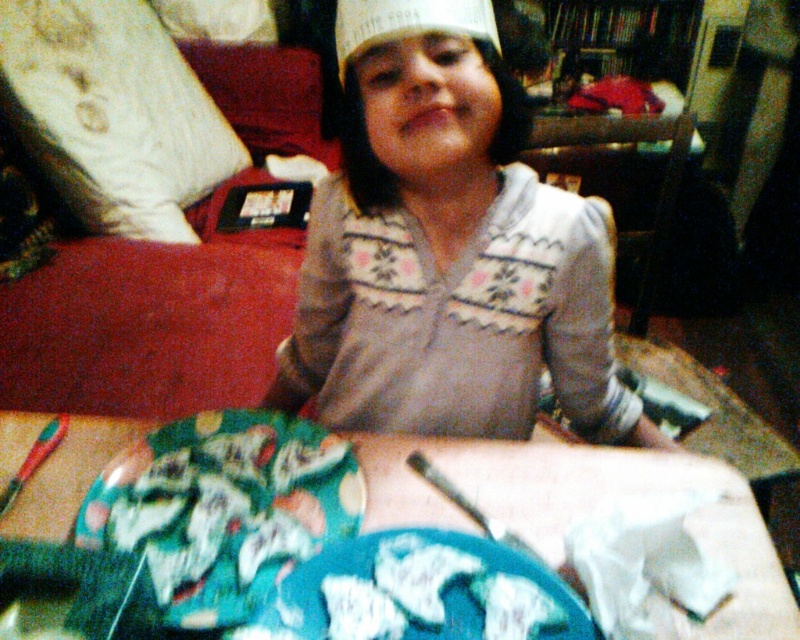
In the dimly lit living room scene, there is a person sitting on a couch wearing a light floral top. They have a white paper hat at center and a floral paper plate at lower center. Which object is positioned to the right side of the other?

The white paper hat at center is to the right of the floral paper plate at lower center because the floral paper plate at lower center is to the left of white paper hat at center.

You are organizing a small party and need to place a decorative item on a shelf. The shelf has limited height space. You have the white knitwear at center and the blue fabric platter at center. Which item should you choose to ensure it fits vertically on the shelf?

The blue fabric platter at center is shorter than the white knitwear at center, so you should choose the blue fabric platter at center to ensure it fits vertically on the shelf.

You are organizing a costume party and need to decide which item to use as a headpiece. You have the white knitwear at center and the white paper hat at center. Which item is more suitable for covering your head?

The white paper hat at center is more suitable for covering your head because it is designed to be worn as a hat, while the white knitwear at center is larger in size and likely meant for wearing as clothing rather than a headpiece.